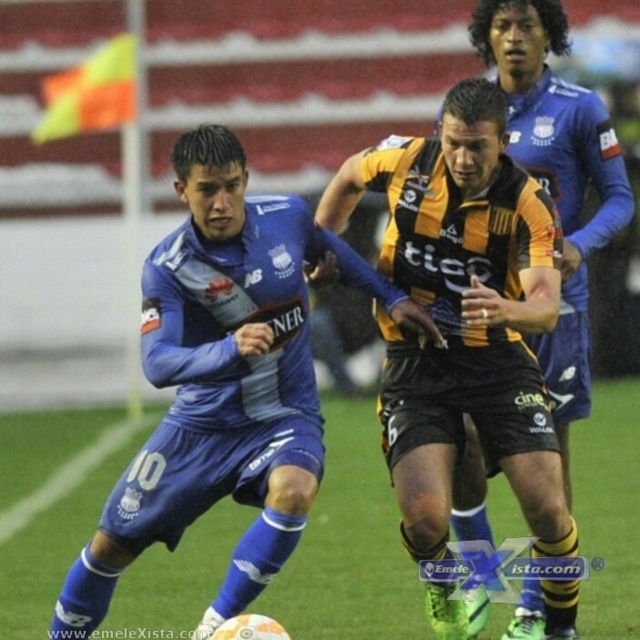
Is point (16, 586) more distant than point (563, 252)?

Yes, it is.

Where is `green grass at center`? The width and height of the screenshot is (640, 640). green grass at center is located at coordinates (349, 547).

Between point (262, 577) and point (369, 572), which one is positioned behind?

The point (369, 572) is behind.

Does point (209, 429) come behind point (22, 541)?

No, it is not.

This screenshot has width=640, height=640. Find the location of `blue jersey at center`. blue jersey at center is located at coordinates (224, 381).

Can you confirm if blue jersey at center is positioned below yellow-orange jersey at center?

Yes, blue jersey at center is below yellow-orange jersey at center.

Image resolution: width=640 pixels, height=640 pixels. Identify the location of blue jersey at center. (224, 381).

Does point (410, 307) come in front of point (579, 378)?

Yes, it is.

Where is `blue jersey at center`? blue jersey at center is located at coordinates (224, 381).